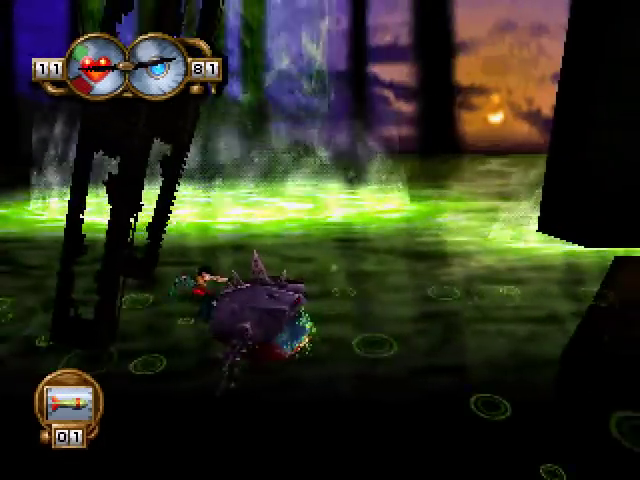
This screenshot has width=640, height=480. I want to click on bold blue wall area, so click(29, 25).